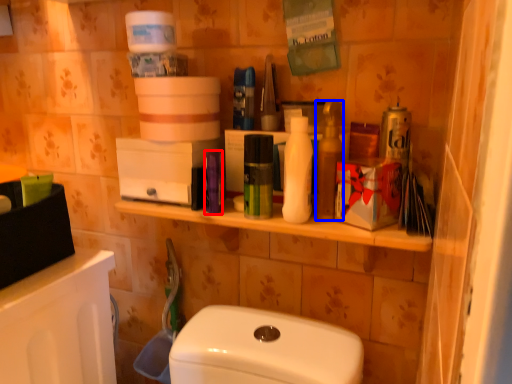
Question: Which object is closer to the camera taking this photo, toiletry (highlighted by a red box) or cleaning product (highlighted by a blue box)?

Choices:
 (A) toiletry
 (B) cleaning product

Answer: (B)